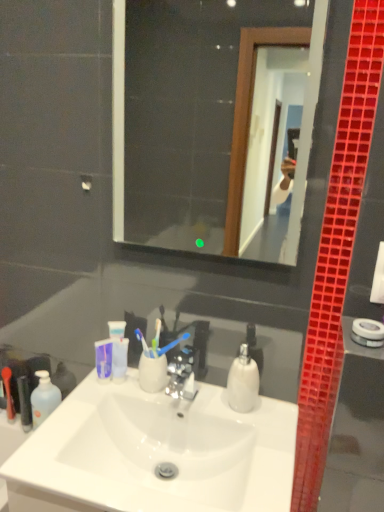
Locate an element on the screen. The height and width of the screenshot is (512, 384). free space to the right of white glossy soap dispenser at center is located at coordinates (273, 422).